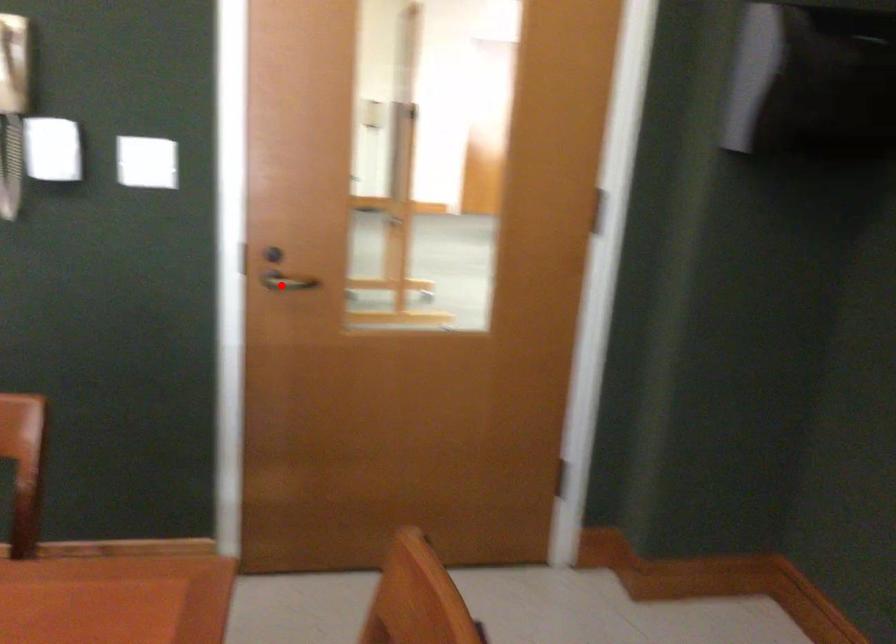
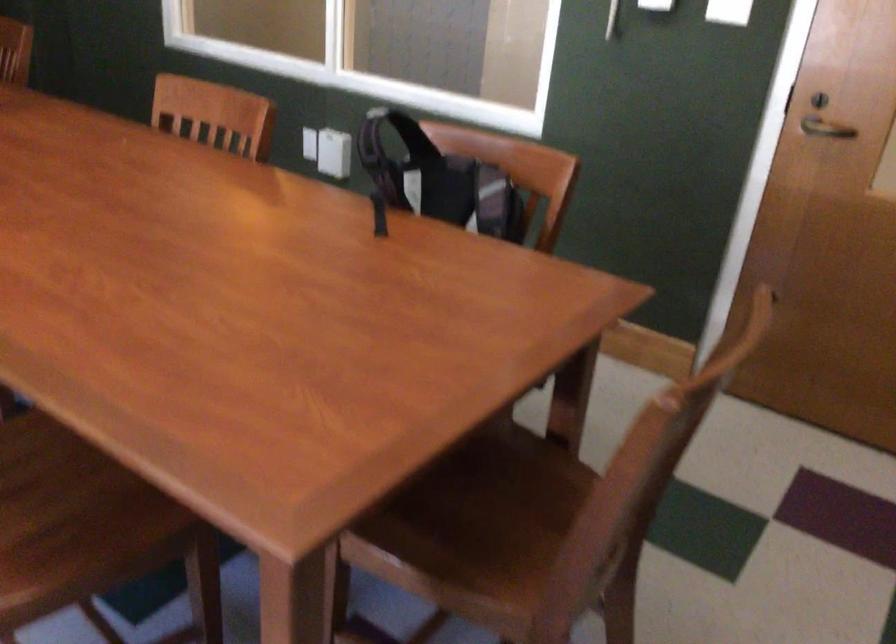
Where in the second image is the point corresponding to the highlighted location from the first image?

(824, 129)